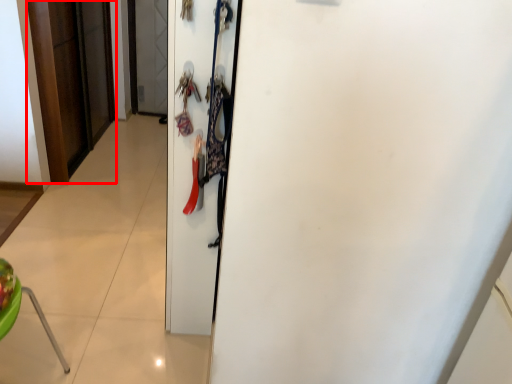
Question: From the image's perspective, what is the correct spatial relationship of door (annotated by the red box) in relation to door?

Choices:
 (A) above
 (B) below

Answer: (A)